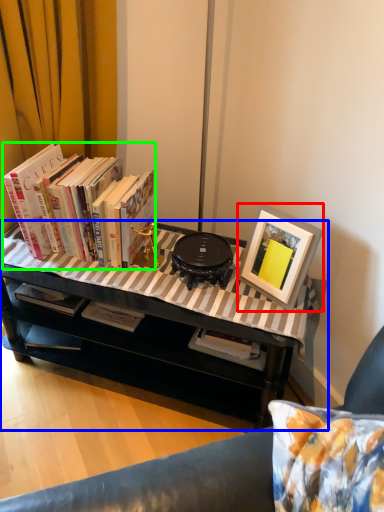
Question: Based on their relative distances, which object is farther from picture frame (highlighted by a red box)? Choose from table (highlighted by a blue box) and book (highlighted by a green box).

Choices:
 (A) table
 (B) book

Answer: (B)